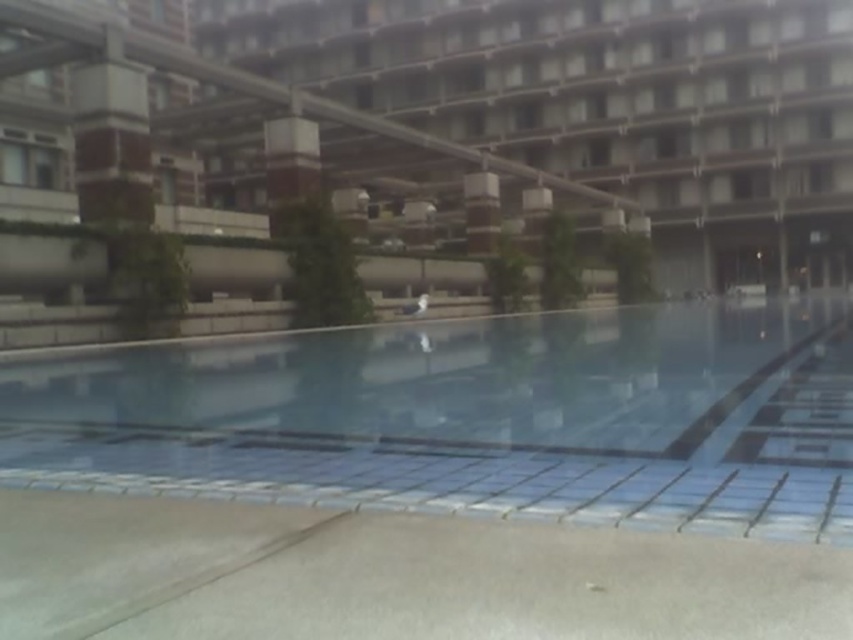
Question: Can you confirm if clear glass pool at center is wider than concrete building at center?

Choices:
 (A) yes
 (B) no

Answer: (A)

Question: Which object appears farthest from the camera in this image?

Choices:
 (A) clear glass pool at center
 (B) concrete building at center

Answer: (B)

Question: Which object is farther from the camera taking this photo?

Choices:
 (A) concrete building at center
 (B) clear glass pool at center

Answer: (A)

Question: From the image, what is the correct spatial relationship of clear glass pool at center in relation to concrete building at center?

Choices:
 (A) above
 (B) below

Answer: (B)

Question: Can you confirm if clear glass pool at center is positioned to the right of concrete building at center?

Choices:
 (A) yes
 (B) no

Answer: (A)